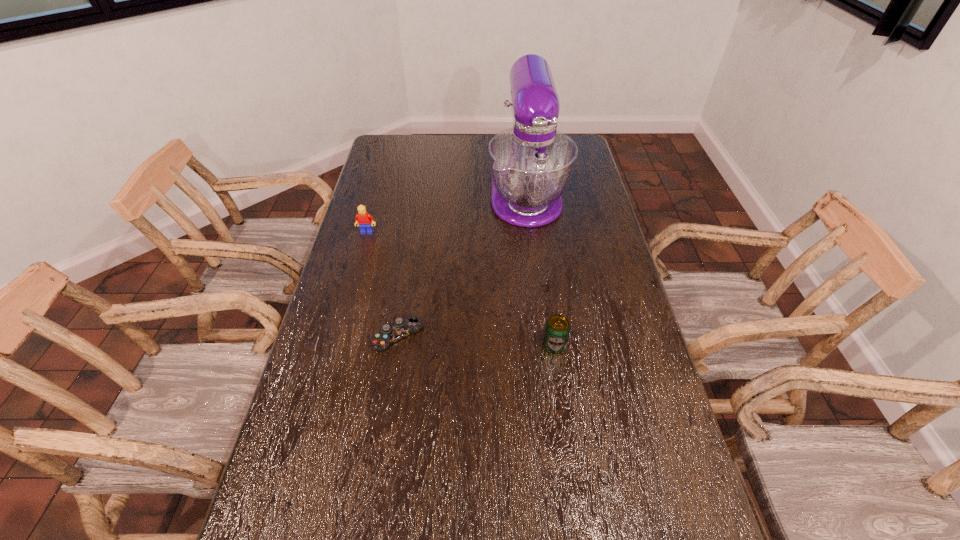
Identify the location of Lego positioned at the left edge. Image resolution: width=960 pixels, height=540 pixels. (363, 219).

Identify the location of control present at the left edge. (401, 328).

The height and width of the screenshot is (540, 960). I want to click on object positioned at the right edge, so click(x=531, y=164).

Identify the location of object that is at the far right corner. (531, 164).

This screenshot has width=960, height=540. In the image, there is a desktop. What are the coordinates of `vacant space at the far edge` in the screenshot? It's located at (431, 160).

Where is `vacant space at the left edge of the desktop`? This screenshot has width=960, height=540. vacant space at the left edge of the desktop is located at coordinates (321, 360).

This screenshot has width=960, height=540. What are the coordinates of `free space at the right edge of the desktop` in the screenshot? It's located at (595, 269).

I want to click on empty space between the second shortest object and the tallest object, so click(540, 270).

You are a GUI agent. You are given a task and a screenshot of the screen. Output one action in this format:
    pyautogui.click(x=<x>, y=<y>)
    Task: Click on the free space between the shortest object and the mixer
    
    Given the screenshot: What is the action you would take?
    pyautogui.click(x=462, y=265)

The width and height of the screenshot is (960, 540). Find the location of `vacant point located between the beer can and the tallest object`. vacant point located between the beer can and the tallest object is located at coordinates (x=540, y=270).